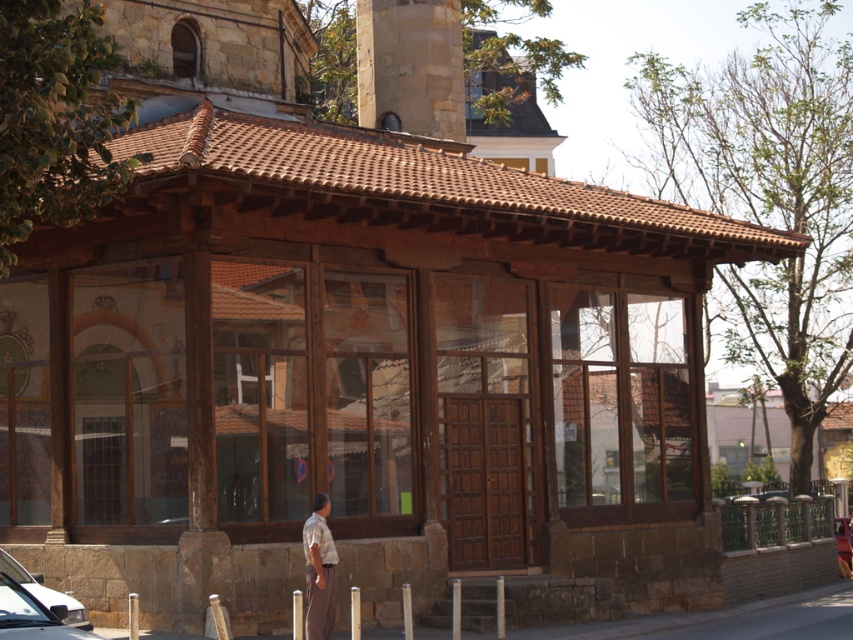
Question: Which of the following is the closest to the observer?

Choices:
 (A) (59, 609)
 (B) (849, 545)
 (C) (326, 625)

Answer: (A)

Question: Does white glossy car at lower left have a greater width compared to metallic red car at center?

Choices:
 (A) no
 (B) yes

Answer: (B)

Question: Among these points, which one is farthest from the camera?

Choices:
 (A) (849, 563)
 (B) (320, 518)

Answer: (A)

Question: Is light brown fabric shirt at center positioned before white glossy car at lower left?

Choices:
 (A) no
 (B) yes

Answer: (A)

Question: Which of the following is the closest to the observer?

Choices:
 (A) metallic red car at center
 (B) light brown fabric shirt at center
 (C) white glossy car at lower left

Answer: (C)

Question: Considering the relative positions of light brown fabric shirt at center and white glossy car at lower left in the image provided, where is light brown fabric shirt at center located with respect to white glossy car at lower left?

Choices:
 (A) right
 (B) left

Answer: (A)